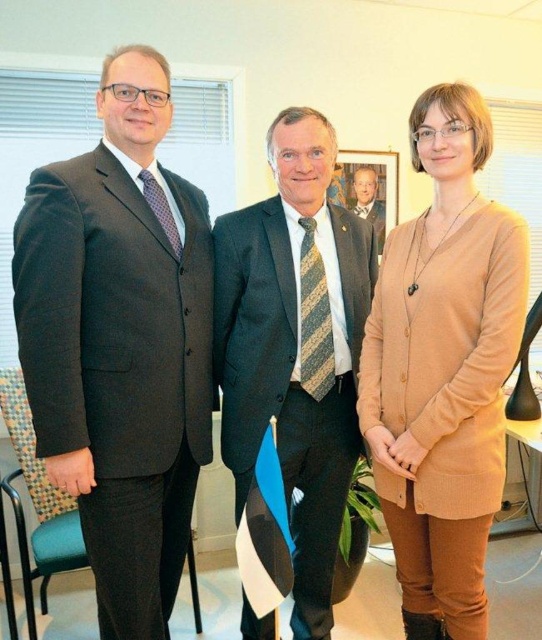
How much distance is there between beige cardigan at center and wooden picture frame at center?

The distance of beige cardigan at center from wooden picture frame at center is 4.96 feet.

This screenshot has height=640, width=542. In order to click on beige cardigan at center in this screenshot , I will do `click(443, 369)`.

Which of these two, matte black suit at left or light brown wood tie at center, stands shorter?

Standing shorter between the two is light brown wood tie at center.

Is matte black suit at left above light brown wood tie at center?

No.

Based on the photo, who is more forward, (207, 236) or (371, 180)?

Point (207, 236) is more forward.

Where is `matte black suit at left`? Image resolution: width=542 pixels, height=640 pixels. matte black suit at left is located at coordinates (120, 342).

Does point (132, 72) come behind point (362, 156)?

No, (132, 72) is closer to viewer.

Between matte black suit at left and wooden picture frame at center, which one is positioned higher?

wooden picture frame at center is above.

Identify the location of matte black suit at left. Image resolution: width=542 pixels, height=640 pixels. (120, 342).

Where is `matte black suit at left`? This screenshot has height=640, width=542. matte black suit at left is located at coordinates (120, 342).